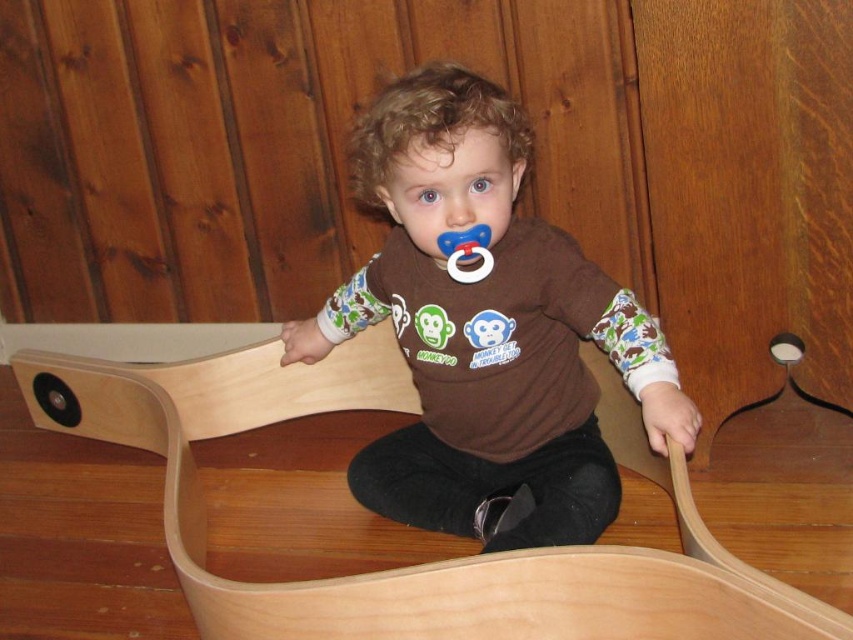
Can you confirm if brown matte shirt at center is positioned to the right of blue rubber pacifier at center?

No, brown matte shirt at center is not to the right of blue rubber pacifier at center.

Does point (514, 228) come closer to viewer compared to point (485, 234)?

That is False.

Between point (462, 205) and point (477, 224), which one is positioned behind?

The point (477, 224) is more distant.

Where is `brown matte shirt at center`? This screenshot has height=640, width=853. brown matte shirt at center is located at coordinates (486, 332).